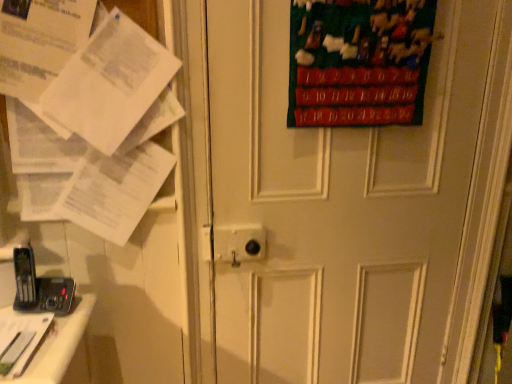
Question: Is white matte door at center inside or outside of black plastic phone at lower left?

Choices:
 (A) outside
 (B) inside

Answer: (A)

Question: From their relative heights in the image, would you say white matte door at center is taller or shorter than black plastic phone at lower left?

Choices:
 (A) short
 (B) tall

Answer: (B)

Question: Estimate the real-world distances between objects in this image. Which object is farther from the white paper at left?

Choices:
 (A) black plastic phone at lower left
 (B) white matte door at center
 (C) velvet green poster at upper right

Answer: (C)

Question: Estimate the real-world distances between objects in this image. Which object is farther from the velvet green poster at upper right?

Choices:
 (A) white matte door at center
 (B) white paper at left
 (C) black plastic phone at lower left

Answer: (C)